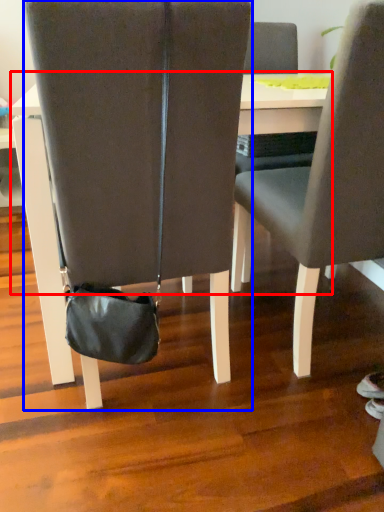
Question: Which point is further to the camera, table (highlighted by a red box) or chair (highlighted by a blue box)?

Choices:
 (A) table
 (B) chair

Answer: (A)